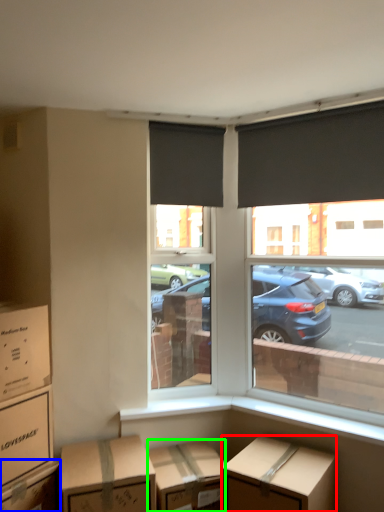
Question: Estimate the real-world distances between objects in this image. Which object is closer to box (highlighted by a red box), box (highlighted by a blue box) or cardboard box (highlighted by a green box)?

Choices:
 (A) box
 (B) cardboard box

Answer: (B)